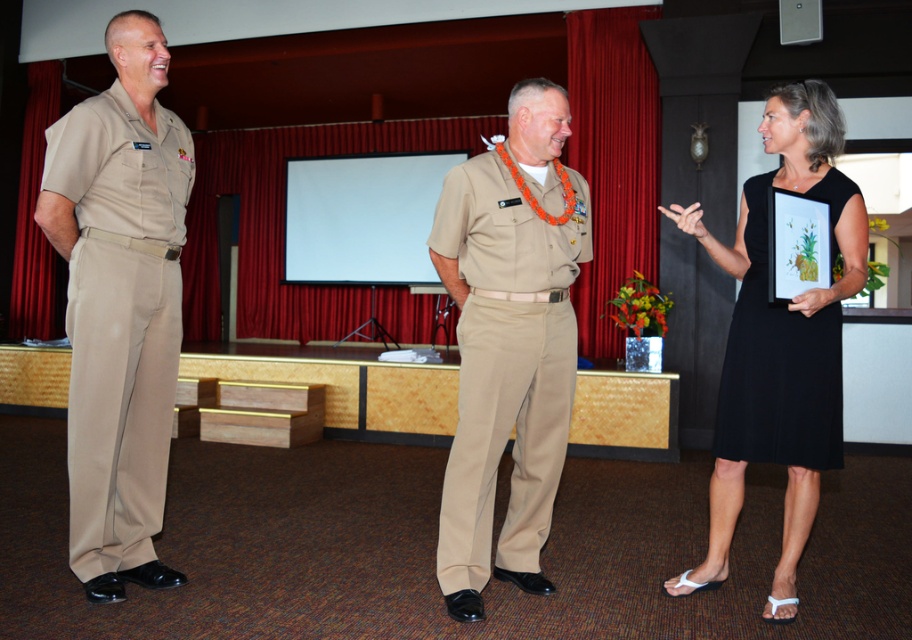
You are standing at the origin point of the coordinate system. You want to move towards the tan cotton pants at left. What direction should you move in?

Since the tan cotton pants at left is located at coordinate point 0.498 on the x axis and 0.133 on the y axis, you should move towards the right and slightly downward to reach it.

In the scene shown: You are standing at the point labeled point [125,132] and want to walk to the point labeled point [770,419]. Which direction should you face to move directly towards your destination?

You should face backward because point [125,132] is in front of point [770,419], so moving backward will take you directly towards point [770,419].